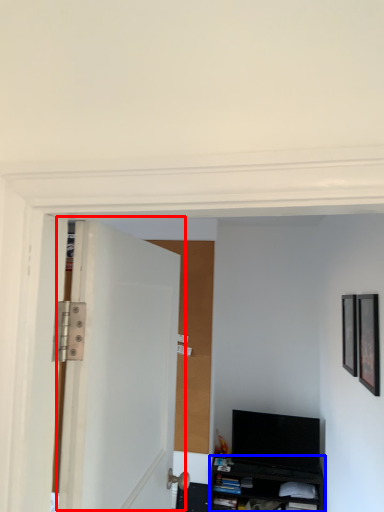
Question: Which object appears closest to the camera in this image, door (highlighted by a red box) or cabinetry (highlighted by a blue box)?

Choices:
 (A) door
 (B) cabinetry

Answer: (A)